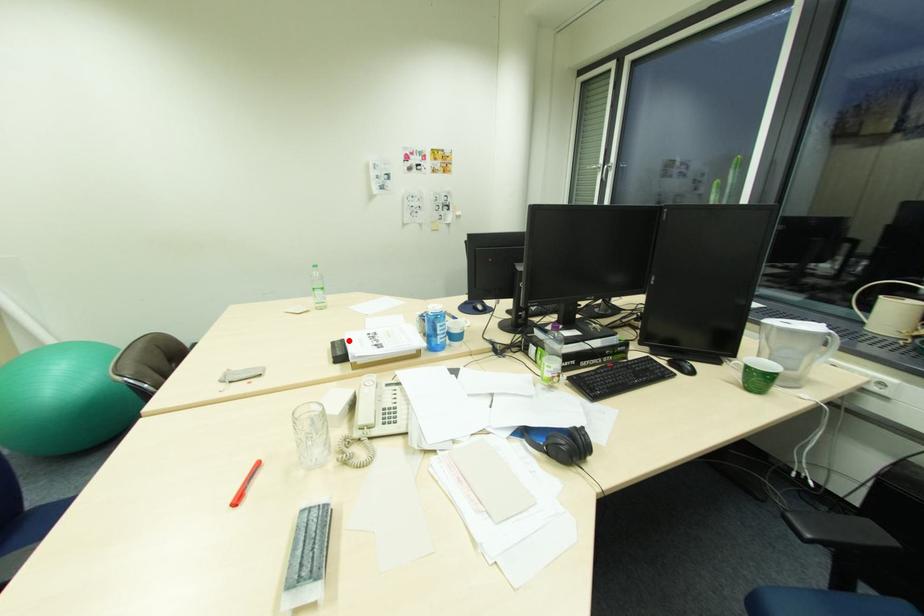
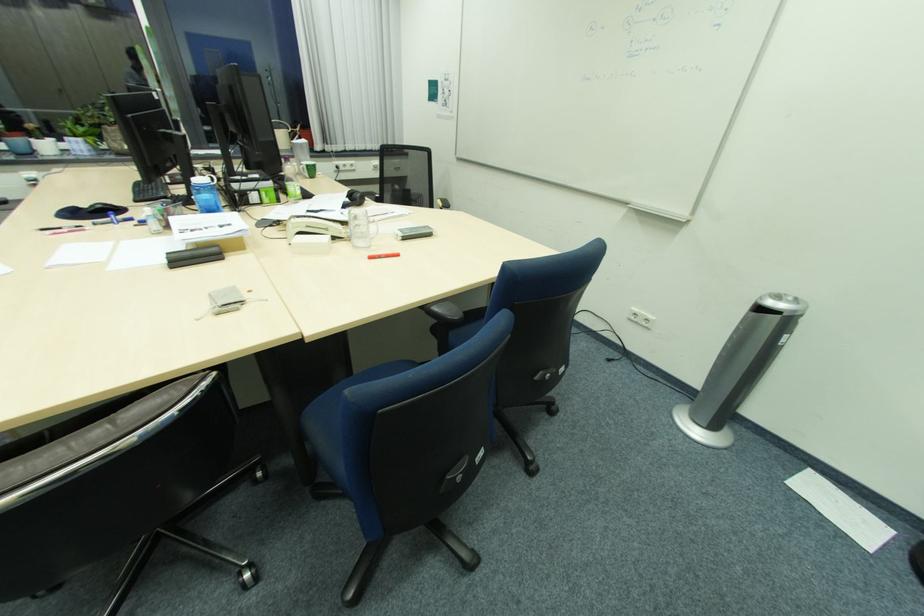
Locate, in the second image, the point that corresponds to the highlighted location in the first image.

(175, 254)